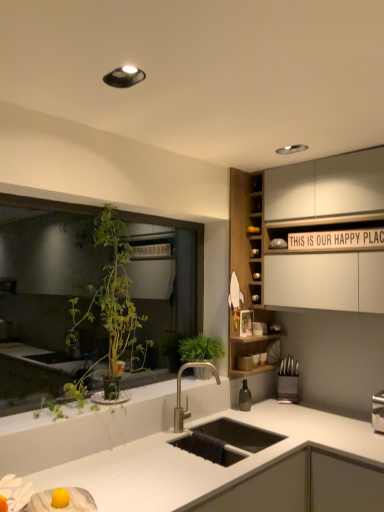
Locate an element on the screen. green leafy plant at left is located at coordinates (196, 252).

What do you see at coordinates (180, 392) in the screenshot?
I see `satin nickel faucet at center` at bounding box center [180, 392].

Where is `wooden cabinet at upper right`? This screenshot has height=512, width=384. wooden cabinet at upper right is located at coordinates (248, 238).

Find the location of a particular element. green leafy plant at left is located at coordinates (196, 252).

Does green leafy plant at left have a greater width compared to satin nickel faucet at center?

Incorrect, the width of green leafy plant at left does not surpass that of satin nickel faucet at center.

Does green leafy plant at left come in front of satin nickel faucet at center?

Yes.

Are green leafy plant at left and satin nickel faucet at center beside each other?

There is a gap between green leafy plant at left and satin nickel faucet at center.

Is green leafy plant at left turned away from black plastic knife block at right?

green leafy plant at left does not have its back to black plastic knife block at right.

Considering the relative sizes of green leafy plant at left and black plastic knife block at right in the image provided, is green leafy plant at left taller than black plastic knife block at right?

Yes.

From a real-world perspective, which object stands above the other?

From a 3D spatial view, green leafy plant at left is above.

How different are the orientations of green leafy plant at left and black plastic knife block at right in degrees?

They differ by 49.6 degrees in their facing directions.

Is white matte countertop at center facing away from green woven basket at center?

That's not correct — white matte countertop at center is not looking away from green woven basket at center.

Can you tell me how much white matte countertop at center and green woven basket at center differ in facing direction?

white matte countertop at center and green woven basket at center are facing 0.00203 degrees away from each other.

From a real-world perspective, is white matte countertop at center on top of green woven basket at center?

No.

Consider the image. Between white matte countertop at center and green woven basket at center, which one has more height?

With more height is white matte countertop at center.

Is there a large distance between green woven basket at center and satin nickel faucet at center?

No, green woven basket at center is in close proximity to satin nickel faucet at center.

Looking at this image, between green woven basket at center and satin nickel faucet at center, which one has smaller width?

satin nickel faucet at center.

From a real-world perspective, relative to satin nickel faucet at center, is green woven basket at center vertically above or below?

From a real-world perspective, green woven basket at center is physically above satin nickel faucet at center.

Where is `tap to the left of green woven basket at center`? tap to the left of green woven basket at center is located at coordinates (180, 392).

Could wooden cabinet at upper right be considered to be inside white matte countertop at center?

No, wooden cabinet at upper right is not surrounded by white matte countertop at center.

Does white matte countertop at center appear on the right side of wooden cabinet at upper right?

Incorrect, white matte countertop at center is not on the right side of wooden cabinet at upper right.

Considering the sizes of objects white matte countertop at center and wooden cabinet at upper right in the image provided, who is shorter, white matte countertop at center or wooden cabinet at upper right?

white matte countertop at center is shorter.

From the image's perspective, between white matte countertop at center and wooden cabinet at upper right, who is located below?

white matte countertop at center is shown below in the image.

Is wooden cabinet at upper right inside green woven basket at center?

Definitely not — wooden cabinet at upper right is not inside green woven basket at center.

Which object is thinner, green woven basket at center or wooden cabinet at upper right?

green woven basket at center.

Is green woven basket at center bigger than wooden cabinet at upper right?

Incorrect, green woven basket at center is not larger than wooden cabinet at upper right.

Does green woven basket at center come behind wooden cabinet at upper right?

No.

Does satin nickel faucet at center have a lesser height compared to white matte countertop at center?

Yes, satin nickel faucet at center is shorter than white matte countertop at center.

How many degrees apart are the facing directions of satin nickel faucet at center and white matte countertop at center?

satin nickel faucet at center and white matte countertop at center are facing 45 degrees away from each other.

Considering the points (176, 432) and (222, 490), which point is behind, point (176, 432) or point (222, 490)?

The point (176, 432) is farther from the camera.

From the image's perspective, is satin nickel faucet at center positioned above or below white matte countertop at center?

satin nickel faucet at center is above white matte countertop at center.

This screenshot has width=384, height=512. I want to click on window that is above the satin nickel faucet at center (from a real-world perspective), so click(x=196, y=252).

At what (x,y) coordinates should I click in order to perform the action: click on appliance below the green leafy plant at left (from the image's perspective). Please return your answer as a coordinate pair (x, y). This screenshot has height=512, width=384. Looking at the image, I should click on (288, 381).

Estimate the real-world distances between objects in this image. Which object is further from black plastic knife block at right, green leafy plant at left or white matte countertop at center?

The object further to black plastic knife block at right is green leafy plant at left.

Looking at this image, from the image, which object appears to be nearer to black plastic knife block at right, wooden cabinet at upper right or green woven basket at center?

Based on the image, green woven basket at center appears to be nearer to black plastic knife block at right.

From the image, which object appears to be farther from black plastic knife block at right, satin nickel faucet at center or green woven basket at center?

satin nickel faucet at center.

Looking at the image, which one is located closer to black plastic knife block at right, white matte countertop at center or green woven basket at center?

Based on the image, green woven basket at center appears to be nearer to black plastic knife block at right.

Which object lies nearer to the anchor point black plastic knife block at right, green woven basket at center or green leafy plant at left?

green woven basket at center is closer to black plastic knife block at right.

From the image, which object appears to be nearer to wooden cabinet at upper right, black plastic knife block at right or satin nickel faucet at center?

black plastic knife block at right.

Estimate the real-world distances between objects in this image. Which object is closer to black plastic knife block at right, green leafy plant at left or green woven basket at center?

green woven basket at center lies closer to black plastic knife block at right than the other object.

Estimate the real-world distances between objects in this image. Which object is further from satin nickel faucet at center, green woven basket at center or green leafy plant at left?

The object further to satin nickel faucet at center is green leafy plant at left.

The width and height of the screenshot is (384, 512). In order to click on tap between white matte countertop at center and green woven basket at center in the front-back direction in this screenshot , I will do `click(180, 392)`.

Image resolution: width=384 pixels, height=512 pixels. I want to click on tap between white matte countertop at center and wooden cabinet at upper right from front to back, so click(180, 392).

The image size is (384, 512). Find the location of `window between white matte countertop at center and black plastic knife block at right from front to back`. window between white matte countertop at center and black plastic knife block at right from front to back is located at coordinates (196, 252).

In order to click on vegetation between green leafy plant at left and wooden cabinet at upper right from left to right in this screenshot , I will do pos(201,349).